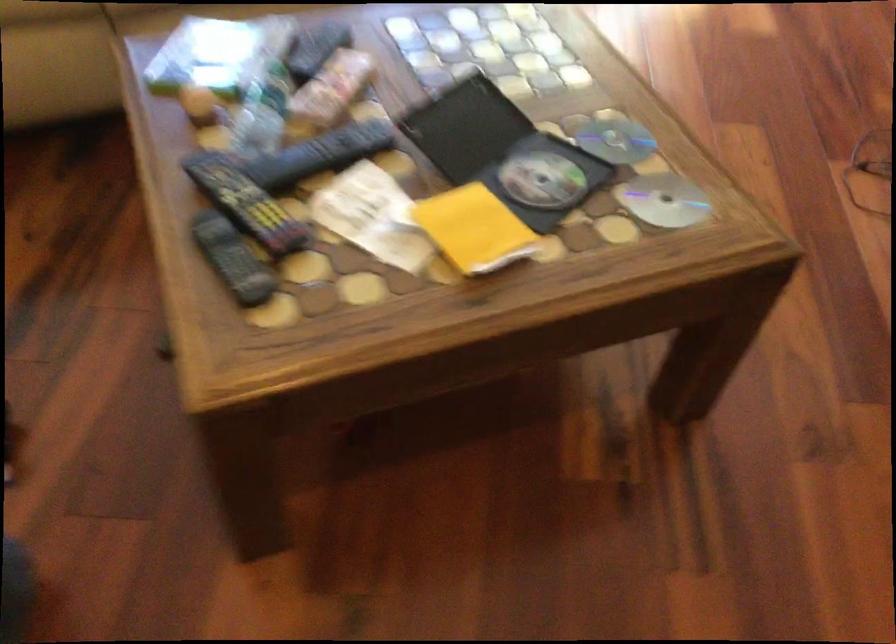
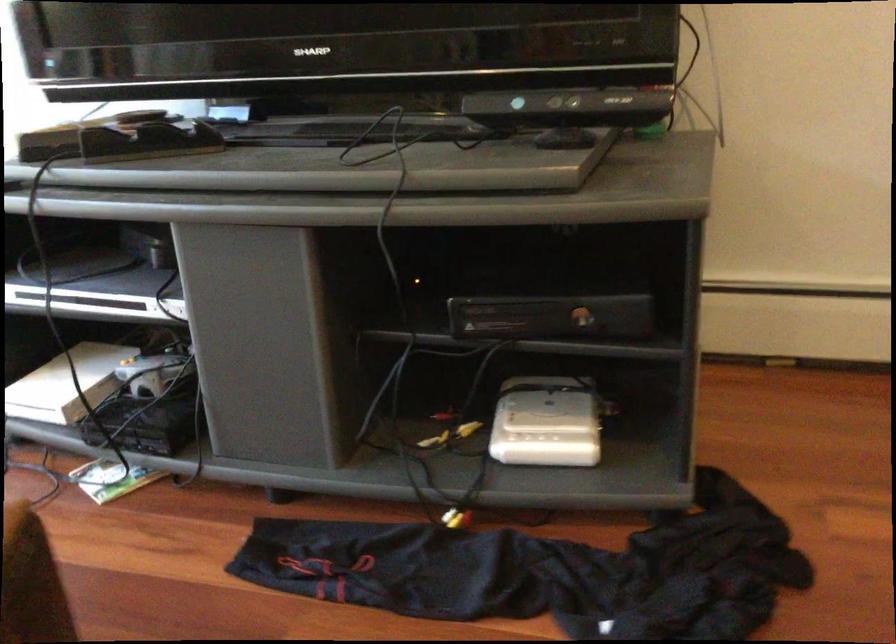
Question: The first image is from the beginning of the video and the second image is from the end. How did the camera likely rotate when shooting the video?

Choices:
 (A) Left
 (B) Right
 (C) Up
 (D) Down

Answer: (B)